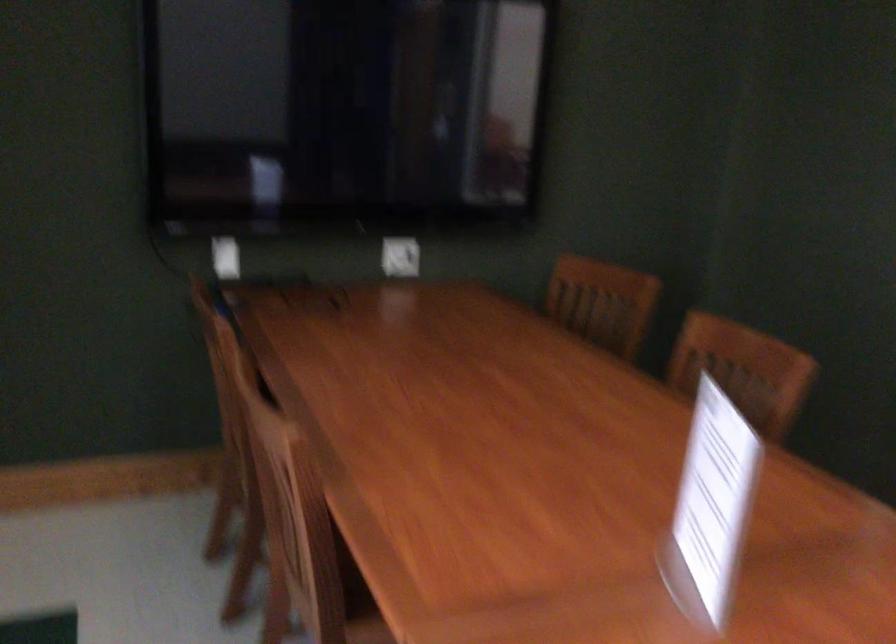
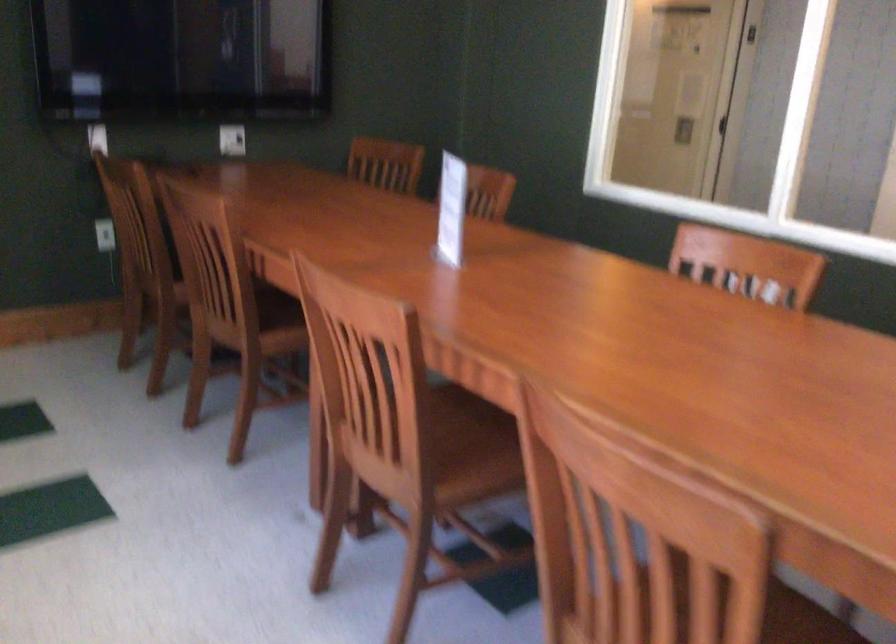
Question: In a continuous first-person perspective shot, in which direction is the camera moving?

Choices:
 (A) Left
 (B) Right
 (C) Forward
 (D) Backward

Answer: (D)